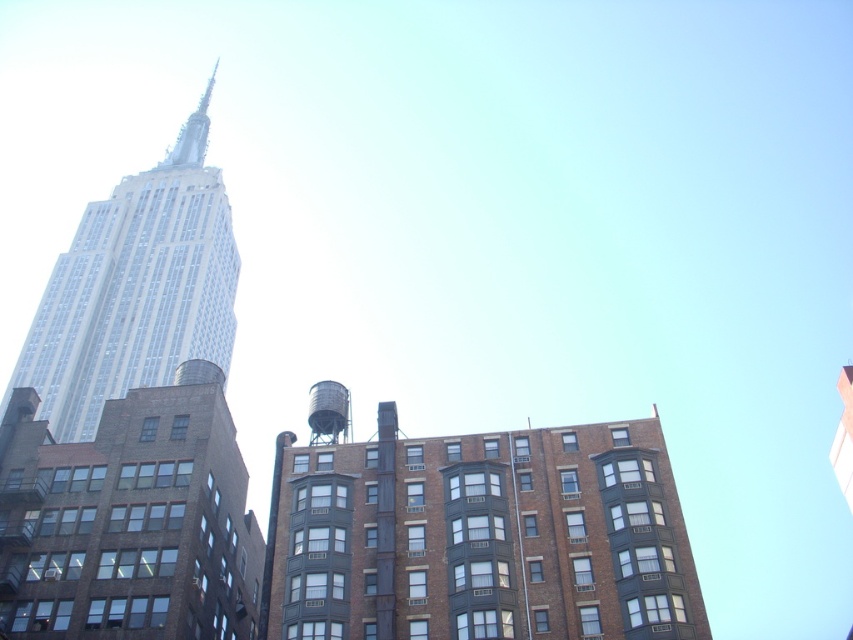
Question: Is white glass tower at left wider than metallic gray water tower at center?

Choices:
 (A) yes
 (B) no

Answer: (A)

Question: Is white glass tower at left to the left of metallic gray water tower at center from the viewer's perspective?

Choices:
 (A) no
 (B) yes

Answer: (B)

Question: Which point is closer to the camera?

Choices:
 (A) (74, 280)
 (B) (323, 413)

Answer: (B)

Question: Is white glass tower at left to the right of metallic gray water tower at center from the viewer's perspective?

Choices:
 (A) yes
 (B) no

Answer: (B)